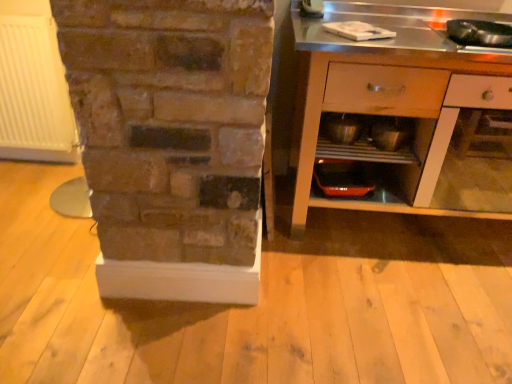
Question: Does metallic silver cabinet at right have a greater width compared to metallic silver bowl at center?

Choices:
 (A) no
 (B) yes

Answer: (B)

Question: Would you say metallic silver cabinet at right is outside metallic silver bowl at center?

Choices:
 (A) yes
 (B) no

Answer: (A)

Question: From the image's perspective, is metallic silver cabinet at right under metallic silver bowl at center?

Choices:
 (A) yes
 (B) no

Answer: (A)

Question: Is metallic silver cabinet at right surrounding metallic silver bowl at center?

Choices:
 (A) no
 (B) yes

Answer: (B)

Question: Is metallic silver cabinet at right to the right of metallic silver bowl at center from the viewer's perspective?

Choices:
 (A) yes
 (B) no

Answer: (A)

Question: Is point click(x=36, y=87) positioned closer to the camera than point click(x=357, y=155)?

Choices:
 (A) closer
 (B) farther

Answer: (B)

Question: Based on their sizes in the image, would you say white matte radiator at left is bigger or smaller than metallic silver shelf at lower center?

Choices:
 (A) small
 (B) big

Answer: (B)

Question: In terms of width, does white matte radiator at left look wider or thinner when compared to metallic silver shelf at lower center?

Choices:
 (A) wide
 (B) thin

Answer: (B)

Question: From the image's perspective, is white matte radiator at left positioned above or below metallic silver shelf at lower center?

Choices:
 (A) above
 (B) below

Answer: (A)

Question: In terms of size, does metallic silver bowl at center appear bigger or smaller than metallic silver cabinet at right?

Choices:
 (A) big
 (B) small

Answer: (B)

Question: Is point (338, 127) closer or farther from the camera than point (396, 72)?

Choices:
 (A) farther
 (B) closer

Answer: (A)

Question: Considering the positions of metallic silver bowl at center and metallic silver cabinet at right in the image, is metallic silver bowl at center wider or thinner than metallic silver cabinet at right?

Choices:
 (A) wide
 (B) thin

Answer: (B)

Question: From a real-world perspective, is metallic silver bowl at center positioned above or below metallic silver cabinet at right?

Choices:
 (A) above
 (B) below

Answer: (A)

Question: Which is correct: metallic silver shelf at lower center is inside metallic silver bowl at center, or outside of it?

Choices:
 (A) inside
 (B) outside

Answer: (B)

Question: Is point (350, 140) closer or farther from the camera than point (350, 119)?

Choices:
 (A) closer
 (B) farther

Answer: (A)